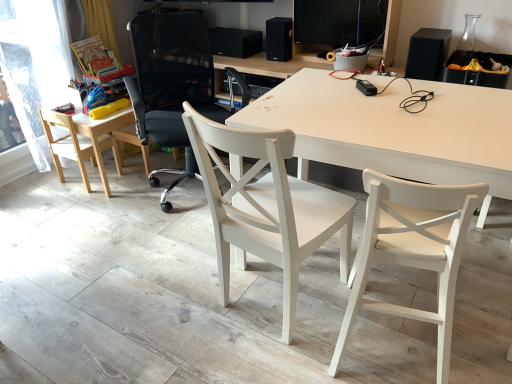
How much space does black matte speaker at upper center, which appears as the second speaker when viewed from the back, occupy vertically?

It is 9.91 inches.

Describe the element at coordinates (76, 145) in the screenshot. I see `light wood chair at left, arranged as the 1th chair when viewed from the left` at that location.

Image resolution: width=512 pixels, height=384 pixels. Find the location of `black matte speaker at upper right, the third speaker positioned from the left`. black matte speaker at upper right, the third speaker positioned from the left is located at coordinates (426, 53).

Find the location of a particular element. Image resolution: width=512 pixels, height=384 pixels. black matte speaker at upper center, marked as the 3th speaker in a right-to-left arrangement is located at coordinates coord(234,42).

Based on the photo, who is shorter, black matte speaker at upper center, marked as the 3th speaker in a right-to-left arrangement, or white wood chair at center, acting as the 3th chair starting from the left?

black matte speaker at upper center, marked as the 3th speaker in a right-to-left arrangement, is shorter.

From the image's perspective, is black matte speaker at upper center, marked as the 3th speaker in a right-to-left arrangement, below white wood chair at center, placed as the 2th chair when sorted from right to left?

Incorrect, from the image's perspective, black matte speaker at upper center, marked as the 3th speaker in a right-to-left arrangement, is higher than white wood chair at center, placed as the 2th chair when sorted from right to left.

Between point (247, 37) and point (209, 130), which one is positioned in front?

Positioned in front is point (209, 130).

Is black matte speaker at upper center, the first speaker when ordered from left to right, oriented away from white wood chair at center, placed as the 2th chair when sorted from right to left?

black matte speaker at upper center, the first speaker when ordered from left to right, does not have its back to white wood chair at center, placed as the 2th chair when sorted from right to left.

From the image's perspective, is matte black monitor at upper center beneath white matte chair at center, the 1th chair positioned from the right?

Actually, matte black monitor at upper center appears above white matte chair at center, the 1th chair positioned from the right, in the image.

From a real-world perspective, relative to white matte chair at center, the 1th chair positioned from the right, is matte black monitor at upper center vertically above or below?

Clearly, from a real-world perspective, matte black monitor at upper center is above white matte chair at center, the 1th chair positioned from the right.

Would you say matte black monitor at upper center is outside white matte chair at center, placed as the 4th chair when sorted from left to right?

Yes, matte black monitor at upper center is not within white matte chair at center, placed as the 4th chair when sorted from left to right.

Is light wood chair at left, the 4th chair from the right, facing towards black matte speaker at upper center, which is the 1th speaker in back-to-front order?

No, light wood chair at left, the 4th chair from the right, is not aimed at black matte speaker at upper center, which is the 1th speaker in back-to-front order.

Are light wood chair at left, arranged as the 1th chair when viewed from the left, and black matte speaker at upper center, marked as the 3th speaker in a right-to-left arrangement, beside each other?

No, light wood chair at left, arranged as the 1th chair when viewed from the left, is not with black matte speaker at upper center, marked as the 3th speaker in a right-to-left arrangement.

In the image, is light wood chair at left, the 4th chair from the right, positioned in front of or behind black matte speaker at upper center, marked as the 3th speaker in a right-to-left arrangement?

light wood chair at left, the 4th chair from the right, is in front of black matte speaker at upper center, marked as the 3th speaker in a right-to-left arrangement.

Between light wood chair at left, the 4th chair from the right, and black matte speaker at upper center, which is the 1th speaker in back-to-front order, which one appears on the left side from the viewer's perspective?

light wood chair at left, the 4th chair from the right, is more to the left.

From the image's perspective, who appears lower, white matte desk at center or transparent plastic window screen at left?

white matte desk at center.

Can transparent plastic window screen at left be found inside white matte desk at center?

Definitely not — transparent plastic window screen at left is not inside white matte desk at center.

Could you tell me if white matte desk at center is turned towards transparent plastic window screen at left?

No, white matte desk at center is not aimed at transparent plastic window screen at left.

From the image's perspective, is black matte speaker at upper right, placed as the 1th speaker when sorted from right to left, positioned above or below black mesh office chair at center, acting as the second chair starting from the left?

Based on their image positions, black matte speaker at upper right, placed as the 1th speaker when sorted from right to left, is located above black mesh office chair at center, acting as the second chair starting from the left.

Is black mesh office chair at center, which is the third chair in right-to-left order, located within black matte speaker at upper right, which is the third speaker in back-to-front order?

No.

Considering their positions, is black matte speaker at upper right, which is the third speaker in back-to-front order, located in front of or behind black mesh office chair at center, which is the third chair in right-to-left order?

Visually, black matte speaker at upper right, which is the third speaker in back-to-front order, is located behind black mesh office chair at center, which is the third chair in right-to-left order.

From a real-world perspective, count 1st chairs downward from the black matte speaker at upper right, which is the third speaker in back-to-front order, and point to it. Please provide its 2D coordinates.

[(170, 84)]

Which is correct: transparent plastic window screen at left is inside matte black monitor at upper center, or outside of it?

transparent plastic window screen at left is not enclosed by matte black monitor at upper center.

How different are the orientations of transparent plastic window screen at left and matte black monitor at upper center in degrees?

The angle between the facing direction of transparent plastic window screen at left and the facing direction of matte black monitor at upper center is 79.9 degrees.

Does transparent plastic window screen at left lie in front of matte black monitor at upper center?

Yes, transparent plastic window screen at left is closer to the camera.

Does transparent plastic window screen at left have a lesser width compared to matte black monitor at upper center?

No, transparent plastic window screen at left is not thinner than matte black monitor at upper center.

From the image's perspective, which one is positioned higher, white wood chair at center, acting as the 3th chair starting from the left, or white matte chair at center, the 1th chair positioned from the right?

white wood chair at center, acting as the 3th chair starting from the left, is shown above in the image.

Would you say white wood chair at center, placed as the 2th chair when sorted from right to left, contains white matte chair at center, the 1th chair positioned from the right?

No, white matte chair at center, the 1th chair positioned from the right, is not inside white wood chair at center, placed as the 2th chair when sorted from right to left.

Considering the sizes of objects white wood chair at center, placed as the 2th chair when sorted from right to left, and white matte chair at center, placed as the 4th chair when sorted from left to right, in the image provided, who is bigger, white wood chair at center, placed as the 2th chair when sorted from right to left, or white matte chair at center, placed as the 4th chair when sorted from left to right,?

With larger size is white wood chair at center, placed as the 2th chair when sorted from right to left.

Consider the image. Considering the sizes of objects white wood chair at center, acting as the 3th chair starting from the left, and white matte chair at center, placed as the 4th chair when sorted from left to right, in the image provided, who is wider, white wood chair at center, acting as the 3th chair starting from the left, or white matte chair at center, placed as the 4th chair when sorted from left to right,?

With larger width is white wood chair at center, acting as the 3th chair starting from the left.

You are a GUI agent. You are given a task and a screenshot of the screen. Output one action in this format:
    pyautogui.click(x=<x>, y=<y>)
    Task: Click on the 1st speaker positioned above the white wood chair at center, acting as the 3th chair starting from the left (from a real-world perspective)
    
    Given the screenshot: What is the action you would take?
    pyautogui.click(x=234, y=42)

Find the location of a particular element. Image resolution: width=512 pixels, height=384 pixels. chair that is the 3rd one when counting forward from the matte black monitor at upper center is located at coordinates (412, 249).

Looking at the image, which one is located closer to matte black monitor at upper center, black matte speaker at upper right, which is counted as the first speaker, starting from the front, or black matte speaker at upper center, which ranks as the 2th speaker in right-to-left order?

The object closer to matte black monitor at upper center is black matte speaker at upper center, which ranks as the 2th speaker in right-to-left order.

When comparing their distances from light wood chair at left, the 4th chair from the right, does white matte chair at center, placed as the 4th chair when sorted from left to right, or black matte speaker at upper center, which is the second speaker from front to back, seem closer?

black matte speaker at upper center, which is the second speaker from front to back.

Based on their spatial positions, is white matte chair at center, placed as the 4th chair when sorted from left to right, or transparent plastic window screen at left further from black matte speaker at upper right, the third speaker positioned from the left?

transparent plastic window screen at left lies further to black matte speaker at upper right, the third speaker positioned from the left, than the other object.

Looking at the image, which one is located closer to black matte speaker at upper right, which is counted as the first speaker, starting from the front, black matte speaker at upper center, which ranks as the 2th speaker in right-to-left order, or black mesh office chair at center, which is the third chair in right-to-left order?

black matte speaker at upper center, which ranks as the 2th speaker in right-to-left order, is positioned closer to the anchor black matte speaker at upper right, which is counted as the first speaker, starting from the front.

Based on their spatial positions, is light wood chair at left, arranged as the 1th chair when viewed from the left, or black mesh office chair at center, which is the third chair in right-to-left order, further from black matte speaker at upper right, which is the third speaker in back-to-front order?

light wood chair at left, arranged as the 1th chair when viewed from the left, lies further to black matte speaker at upper right, which is the third speaker in back-to-front order, than the other object.

Considering their positions, is white matte desk at center positioned closer to black matte speaker at upper center, the 3th speaker when ordered from front to back, than transparent plastic window screen at left?

transparent plastic window screen at left.

Looking at the image, which one is located closer to black matte speaker at upper right, which is counted as the first speaker, starting from the front, transparent plastic window screen at left or black mesh office chair at center, acting as the second chair starting from the left?

Among the two, black mesh office chair at center, acting as the second chair starting from the left, is located nearer to black matte speaker at upper right, which is counted as the first speaker, starting from the front.

Estimate the real-world distances between objects in this image. Which object is closer to white matte desk at center, light wood chair at left, the 4th chair from the right, or black mesh office chair at center, acting as the second chair starting from the left?

The object closer to white matte desk at center is black mesh office chair at center, acting as the second chair starting from the left.

At what (x,y) coordinates should I click in order to perform the action: click on speaker between black matte speaker at upper center, the first speaker when ordered from left to right, and matte black monitor at upper center. Please return your answer as a coordinate pair (x, y). This screenshot has height=384, width=512. Looking at the image, I should click on (279, 39).

Find the location of a particular element. This screenshot has height=384, width=512. desk between black mesh office chair at center, acting as the second chair starting from the left, and black matte speaker at upper right, the third speaker positioned from the left, from left to right is located at coordinates (394, 130).

You are a GUI agent. You are given a task and a screenshot of the screen. Output one action in this format:
    pyautogui.click(x=<x>, y=<y>)
    Task: Click on the desk between white matte chair at center, the 1th chair positioned from the right, and black matte speaker at upper center, which is the 1th speaker in back-to-front order, along the z-axis
    This screenshot has width=512, height=384.
    Given the screenshot: What is the action you would take?
    pyautogui.click(x=394, y=130)

This screenshot has height=384, width=512. I want to click on computer monitor between light wood chair at left, arranged as the 1th chair when viewed from the left, and black matte speaker at upper right, which is counted as the first speaker, starting from the front, in the horizontal direction, so click(340, 22).